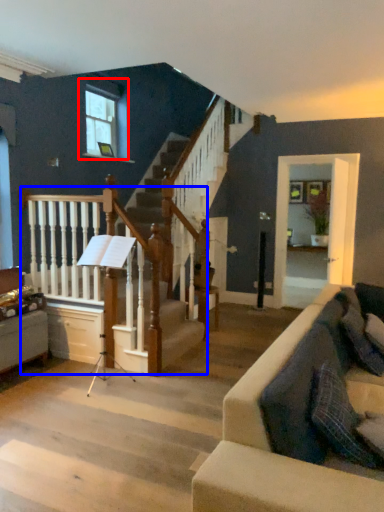
Question: Among these objects, which one is nearest to the camera, window (highlighted by a red box) or rail (highlighted by a blue box)?

Choices:
 (A) window
 (B) rail

Answer: (B)